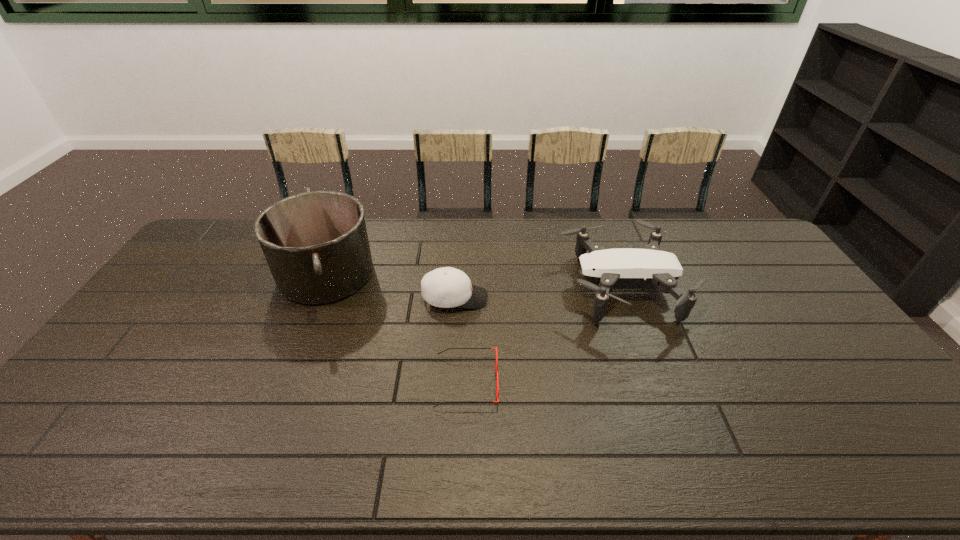
At what (x,y) coordinates should I click in order to perform the action: click on the tallest object. Please return your answer as a coordinate pair (x, y). This screenshot has width=960, height=540. Looking at the image, I should click on (316, 245).

This screenshot has width=960, height=540. I want to click on pan, so click(316, 245).

Locate an element on the screen. The image size is (960, 540). the rightmost object is located at coordinates (604, 269).

You are a GUI agent. You are given a task and a screenshot of the screen. Output one action in this format:
    pyautogui.click(x=<x>, y=<y>)
    Task: Click on the drone
    
    Given the screenshot: What is the action you would take?
    pyautogui.click(x=604, y=269)

Locate an element on the screen. Image resolution: width=960 pixels, height=540 pixels. the second shortest object is located at coordinates (x=447, y=287).

The height and width of the screenshot is (540, 960). Identify the location of the shortest object. click(497, 382).

Find the location of a particular element. The width and height of the screenshot is (960, 540). the nearest object is located at coordinates (497, 382).

Locate an element on the screen. free space located 0.360m on the front of the leftmost object is located at coordinates (263, 431).

This screenshot has height=540, width=960. In order to click on blank space located on the camera side of the second tallest object in this screenshot , I will do `click(489, 288)`.

Find the location of `free location located 0.380m on the camera side of the second tallest object`. free location located 0.380m on the camera side of the second tallest object is located at coordinates (445, 288).